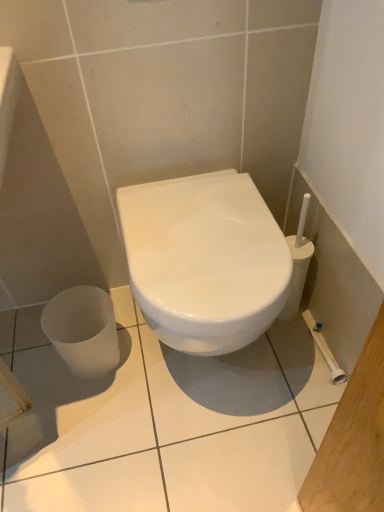
Where is `white glossy ceramic tile at center`? The width and height of the screenshot is (384, 512). white glossy ceramic tile at center is located at coordinates (165, 422).

What is the approximate height of white glossy ceramic tile at center?

It is 1.32 inches.

Describe the element at coordinates (165, 422) in the screenshot. I see `white glossy ceramic tile at center` at that location.

Image resolution: width=384 pixels, height=512 pixels. Describe the element at coordinates (205, 260) in the screenshot. I see `white glossy toilet at center` at that location.

This screenshot has width=384, height=512. I want to click on white glossy toilet at center, so click(205, 260).

This screenshot has width=384, height=512. Identify the location of white glossy ceramic tile at center. (165, 422).

Is white glossy ceramic tile at center at the left side of white glossy toilet at center?

Indeed, white glossy ceramic tile at center is positioned on the left side of white glossy toilet at center.

Who is more distant, white glossy ceramic tile at center or white glossy toilet at center?

Result: Positioned behind is white glossy ceramic tile at center.

Does point (24, 462) come closer to viewer compared to point (232, 338)?

That is False.

From the image's perspective, is white glossy ceramic tile at center located above white glossy toilet at center?

No, from the image's perspective, white glossy ceramic tile at center is not above white glossy toilet at center.

Based on the photo, from a real-world perspective, is white glossy ceramic tile at center physically located above or below white glossy toilet at center?

white glossy ceramic tile at center is situated lower than white glossy toilet at center in the real world.

From the picture: Considering the sizes of white glossy ceramic tile at center and white glossy toilet at center in the image, is white glossy ceramic tile at center wider or thinner than white glossy toilet at center?

white glossy ceramic tile at center is wider than white glossy toilet at center.

Based on the photo, does white glossy ceramic tile at center have a lesser height compared to white glossy toilet at center?

Yes.

Who is bigger, white glossy ceramic tile at center or white glossy toilet at center?

white glossy toilet at center is bigger.

Is white glossy ceramic tile at center inside or outside of white glossy toilet at center?

The correct answer is: outside.

Can you see white glossy ceramic tile at center touching white glossy toilet at center?

No, white glossy ceramic tile at center is not next to white glossy toilet at center.

Is white glossy toilet at center at the back of white glossy ceramic tile at center?

No, white glossy toilet at center is not at the back of white glossy ceramic tile at center.

How far apart are white glossy ceramic tile at center and white glossy toilet at center?

17.58 inches.

Find the location of `ceramic tile located below the white glossy toilet at center (from the image's perspective)`. ceramic tile located below the white glossy toilet at center (from the image's perspective) is located at coordinates click(x=165, y=422).

Considering the positions of objects white glossy toilet at center and white glossy ceramic tile at center in the image provided, who is more to the left, white glossy toilet at center or white glossy ceramic tile at center?

A: From the viewer's perspective, white glossy ceramic tile at center appears more on the left side.

From the picture: Is white glossy toilet at center in front of or behind white glossy ceramic tile at center in the image?

In the image, white glossy toilet at center appears in front of white glossy ceramic tile at center.

Which is in front, point (172, 211) or point (57, 360)?

Positioned in front is point (172, 211).

From the image's perspective, relative to white glossy ceramic tile at center, is white glossy toilet at center above or below?

From the image's perspective, white glossy toilet at center appears above white glossy ceramic tile at center.

From a real-world perspective, is white glossy toilet at center above or below white glossy ceramic tile at center?

In terms of real-world spatial position, white glossy toilet at center is above white glossy ceramic tile at center.

Is white glossy toilet at center wider than white glossy ceramic tile at center?

No.

Can you confirm if white glossy toilet at center is shorter than white glossy ceramic tile at center?

No, white glossy toilet at center is not shorter than white glossy ceramic tile at center.

Considering the sizes of objects white glossy toilet at center and white glossy ceramic tile at center in the image provided, who is smaller, white glossy toilet at center or white glossy ceramic tile at center?

Smaller between the two is white glossy ceramic tile at center.

Is white glossy toilet at center not inside white glossy ceramic tile at center?

Yes, white glossy toilet at center is located beyond the bounds of white glossy ceramic tile at center.

Are white glossy toilet at center and white glossy ceramic tile at center beside each other?

No, white glossy toilet at center is not making contact with white glossy ceramic tile at center.

Consider the image. Is white glossy toilet at center oriented away from white glossy ceramic tile at center?

No, white glossy toilet at center's orientation is not away from white glossy ceramic tile at center.

This screenshot has width=384, height=512. I want to click on ceramic tile below the white glossy toilet at center (from a real-world perspective), so click(165, 422).

Image resolution: width=384 pixels, height=512 pixels. What are the coordinates of `ceramic tile on the left of white glossy toilet at center` in the screenshot? It's located at (165, 422).

Locate an element on the screen. This screenshot has width=384, height=512. ceramic tile below the white glossy toilet at center (from the image's perspective) is located at coordinates (165, 422).